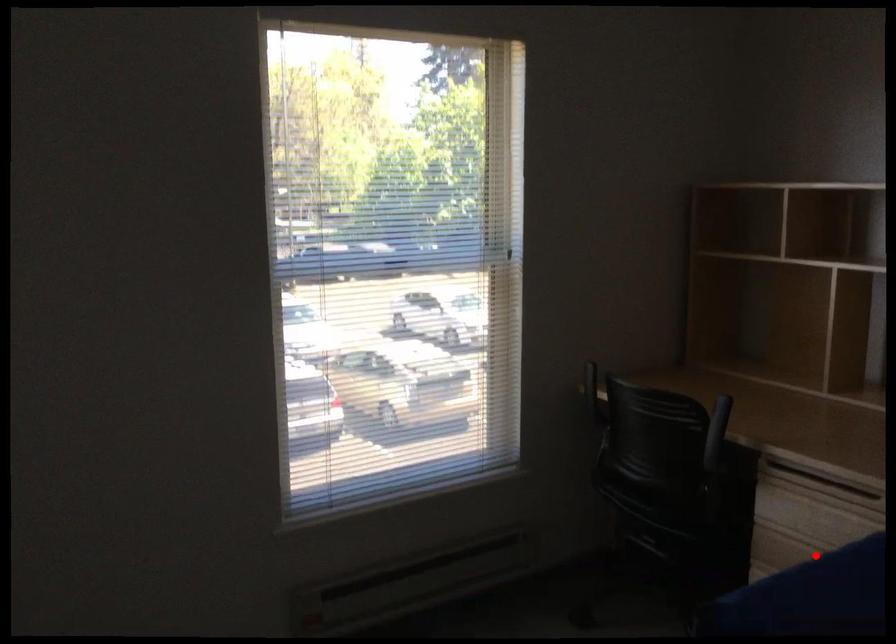
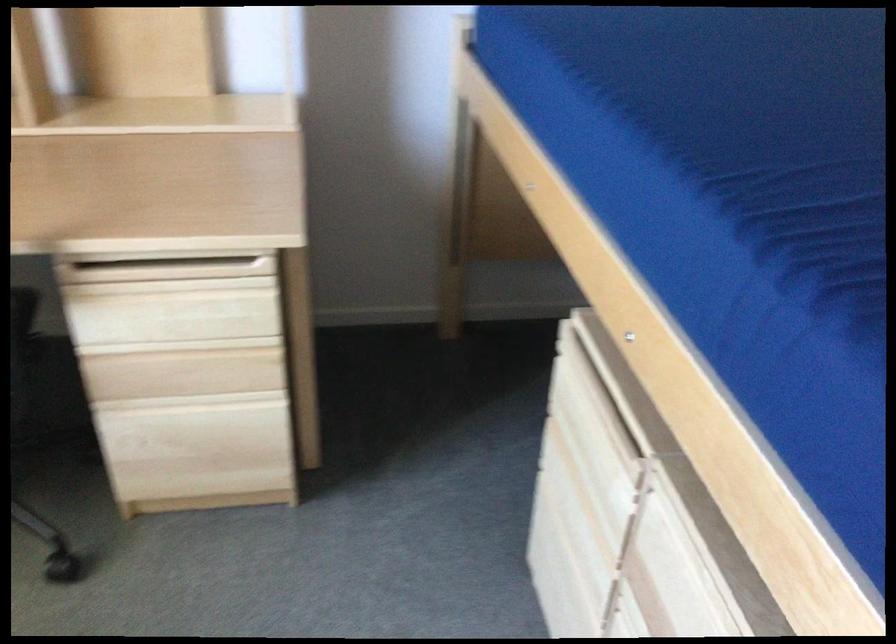
Find the pixel in the second image that matches the highlighted location in the first image.

(179, 346)